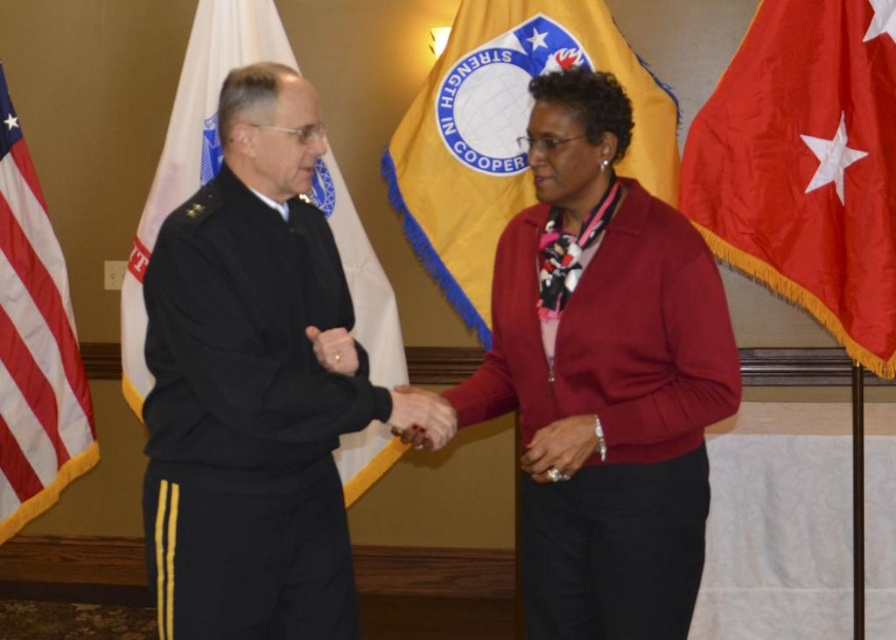
Question: Does matte red jacket at center have a smaller size compared to red fabric flag at right?

Choices:
 (A) no
 (B) yes

Answer: (A)

Question: Does white fabric flag at left have a greater width compared to red-white striped flag at left?

Choices:
 (A) no
 (B) yes

Answer: (B)

Question: Which object appears farthest from the camera in this image?

Choices:
 (A) yellow fabric flag at center
 (B) red fabric flag at right

Answer: (A)

Question: Which point is closer to the camera taking this photo?

Choices:
 (A) (821, 248)
 (B) (240, 52)

Answer: (A)

Question: Considering the relative positions of matte red jacket at center and white fabric flag at left in the image provided, where is matte red jacket at center located with respect to white fabric flag at left?

Choices:
 (A) right
 (B) left

Answer: (A)

Question: Among these objects, which one is nearest to the camera?

Choices:
 (A) white fabric flag at left
 (B) red-white striped flag at left

Answer: (A)